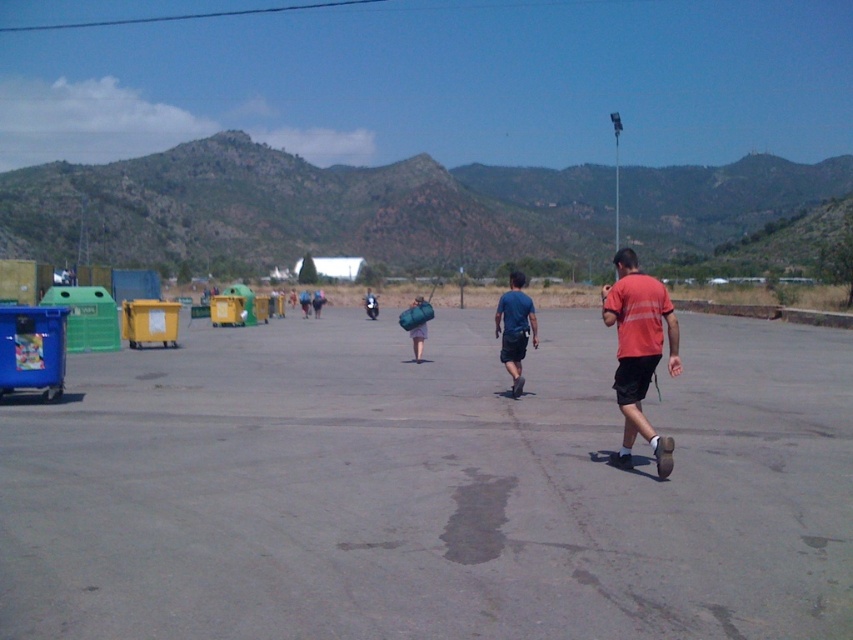
Is point (659, 301) positioned in front of point (518, 348)?

Yes, it is.

Which is more to the right, orange cotton t-shirt at right or blue fabric shirt at center?

Positioned to the right is orange cotton t-shirt at right.

The width and height of the screenshot is (853, 640). Describe the element at coordinates (639, 353) in the screenshot. I see `orange cotton t-shirt at right` at that location.

The height and width of the screenshot is (640, 853). Find the location of `orange cotton t-shirt at right`. orange cotton t-shirt at right is located at coordinates (639, 353).

Does point (654, 289) come in front of point (373, 300)?

Yes, point (654, 289) is in front of point (373, 300).

At what (x,y) coordinates should I click in order to perform the action: click on orange cotton t-shirt at right. Please return your answer as a coordinate pair (x, y). This screenshot has height=640, width=853. Looking at the image, I should click on (639, 353).

Is blue fabric shirt at center behind matte blue backpack at center?

No.

Measure the distance between blue fabric shirt at center and camera.

blue fabric shirt at center is 12.78 meters from camera.

Who is more distant from viewer, (525, 332) or (368, 308)?

The point (368, 308) is behind.

The height and width of the screenshot is (640, 853). What are the coordinates of `blue fabric shirt at center` in the screenshot? It's located at (515, 328).